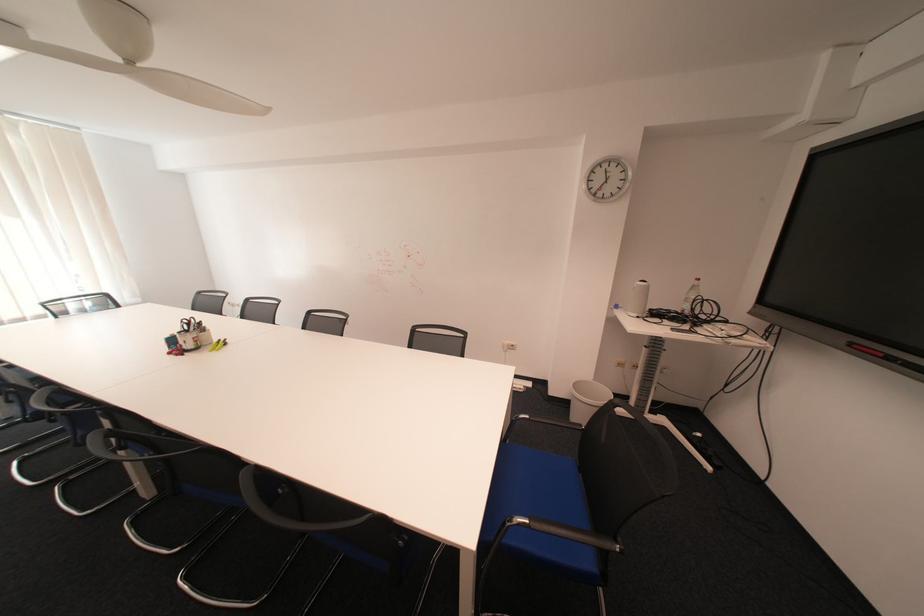
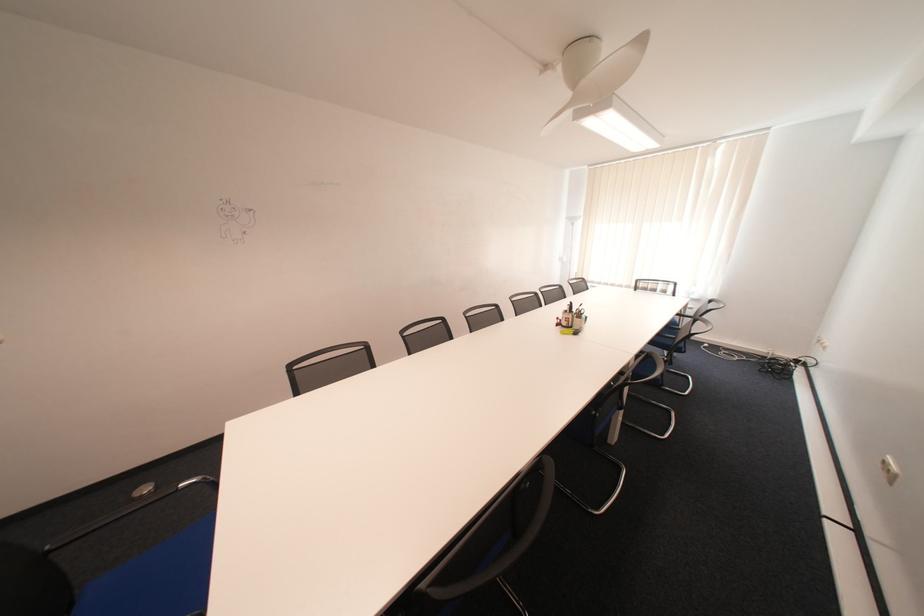
Find the pixel in the second image that matches point 198,331 in the first image.

(578, 312)